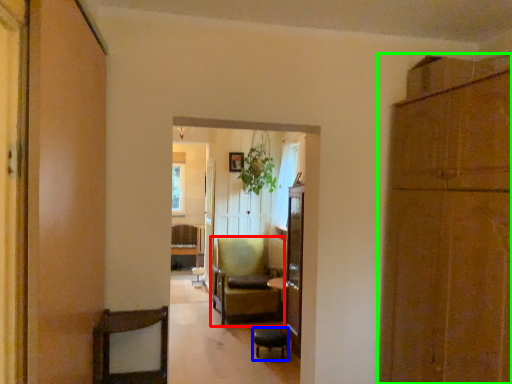
Question: Considering the real-world distances, which object is closest to chair (highlighted by a red box)? bar stool (highlighted by a blue box) or cabinetry (highlighted by a green box).

Choices:
 (A) bar stool
 (B) cabinetry

Answer: (A)